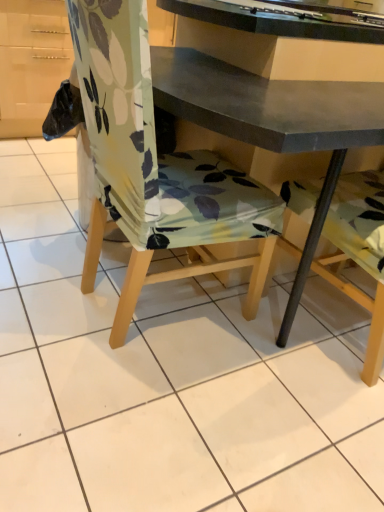
Where is `floral fabric chair at center`? floral fabric chair at center is located at coordinates (155, 167).

The image size is (384, 512). Describe the element at coordinates (155, 167) in the screenshot. I see `floral fabric chair at center` at that location.

Describe the element at coordinates (282, 111) in the screenshot. I see `matte gray desk at center` at that location.

Identify the location of matte gray desk at center. The width and height of the screenshot is (384, 512). (282, 111).

In order to face matte gray desk at center, should I rotate leftwards or rightwards?

To align with it, rotate right about 26.517°.

Locate an element on the screen. This screenshot has height=512, width=384. floral fabric chair at center is located at coordinates (155, 167).

Does matte gray desk at center appear on the right side of floral fabric chair at center?

Indeed, matte gray desk at center is positioned on the right side of floral fabric chair at center.

In the scene shown: Which object is closer to the camera taking this photo, matte gray desk at center or floral fabric chair at center?

Positioned in front is floral fabric chair at center.

Which is in front, point (225, 128) or point (202, 190)?

The point (225, 128) is in front.

From the image's perspective, who appears lower, matte gray desk at center or floral fabric chair at center?

matte gray desk at center appears lower in the image.

From a real-world perspective, is matte gray desk at center positioned above or below floral fabric chair at center?

From a real-world perspective, matte gray desk at center is physically above floral fabric chair at center.

Which of these two, matte gray desk at center or floral fabric chair at center, is wider?

Wider between the two is floral fabric chair at center.

From their relative heights in the image, would you say matte gray desk at center is taller or shorter than floral fabric chair at center?

Clearly, matte gray desk at center is taller compared to floral fabric chair at center.

Can you confirm if matte gray desk at center is smaller than floral fabric chair at center?

Correct, matte gray desk at center occupies less space than floral fabric chair at center.

Is matte gray desk at center inside or outside of floral fabric chair at center?

matte gray desk at center is spatially situated outside floral fabric chair at center.

Is matte gray desk at center beside floral fabric chair at center?

No, matte gray desk at center is not touching floral fabric chair at center.

Could you tell me if matte gray desk at center is facing floral fabric chair at center?

No, matte gray desk at center is not turned towards floral fabric chair at center.

How much distance is there between matte gray desk at center and floral fabric chair at center?

matte gray desk at center and floral fabric chair at center are 10.36 inches apart from each other.

Locate an element on the screen. Image resolution: width=384 pixels, height=512 pixels. chair on the left of the matte gray desk at center is located at coordinates (155, 167).

Looking at this image, in the image, is floral fabric chair at center on the left side or the right side of matte gray desk at center?

Based on their positions, floral fabric chair at center is located to the left of matte gray desk at center.

Which object is further away from the camera taking this photo, floral fabric chair at center or matte gray desk at center?

matte gray desk at center is further away from the camera.

Which is in front, point (117, 210) or point (321, 93)?

The point (321, 93) is more forward.

From the image's perspective, does floral fabric chair at center appear higher than matte gray desk at center?

Yes.

From a real-world perspective, is floral fabric chair at center under matte gray desk at center?

Yes, from a real-world perspective, floral fabric chair at center is under matte gray desk at center.

Is floral fabric chair at center thinner than matte gray desk at center?

No, floral fabric chair at center is not thinner than matte gray desk at center.

Does floral fabric chair at center have a greater height compared to matte gray desk at center?

Incorrect, the height of floral fabric chair at center is not larger of that of matte gray desk at center.

Is floral fabric chair at center bigger or smaller than matte gray desk at center?

floral fabric chair at center is bigger than matte gray desk at center.

Is floral fabric chair at center outside of matte gray desk at center?

Indeed, floral fabric chair at center is completely outside matte gray desk at center.

Is floral fabric chair at center far from matte gray desk at center?

Actually, floral fabric chair at center and matte gray desk at center are a little close together.

Is matte gray desk at center at the back of floral fabric chair at center?

No.

Can you tell me how much floral fabric chair at center and matte gray desk at center differ in facing direction?

The angular difference between floral fabric chair at center and matte gray desk at center is 92.1 degrees.

In the scene shown: Measure the distance from floral fabric chair at center to matte gray desk at center.

10.36 inches.

Image resolution: width=384 pixels, height=512 pixels. I want to click on chair that is on the left side of matte gray desk at center, so (x=155, y=167).

Identify the location of chair in front of the matte gray desk at center. (155, 167).

Where is `desk on the right of floral fabric chair at center`? desk on the right of floral fabric chair at center is located at coordinates (282, 111).